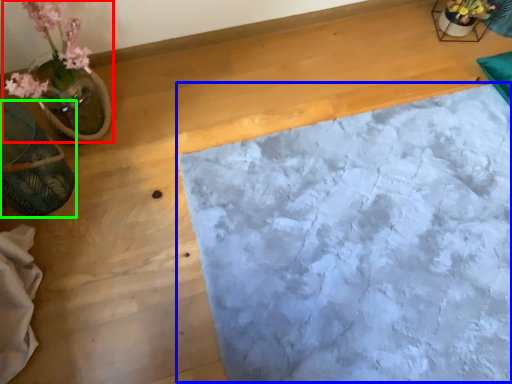
Question: Estimate the real-world distances between objects in this image. Which object is farther from houseplant (highlighted by a red box), sheet (highlighted by a blue box) or flowerpot (highlighted by a green box)?

Choices:
 (A) sheet
 (B) flowerpot

Answer: (A)